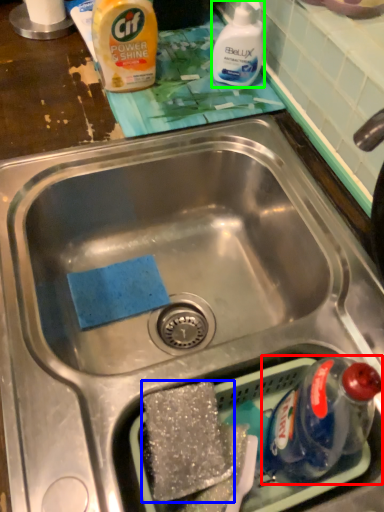
Question: Estimate the real-world distances between objects in this image. Which object is farther from bottle (highlighted by a red box), food (highlighted by a blue box) or cleaning product (highlighted by a green box)?

Choices:
 (A) food
 (B) cleaning product

Answer: (B)